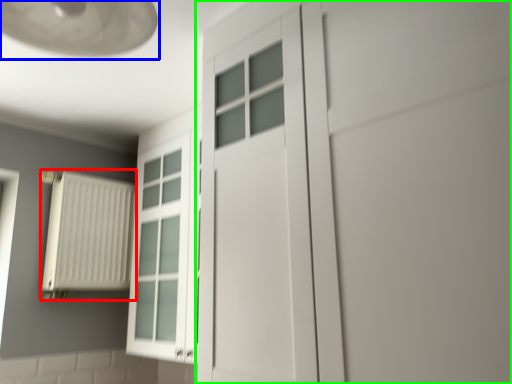
Question: Based on their relative distances, which object is nearer to radiator (highlighted by a red box)? Choose from lamp (highlighted by a blue box) and door (highlighted by a green box).

Choices:
 (A) lamp
 (B) door

Answer: (A)